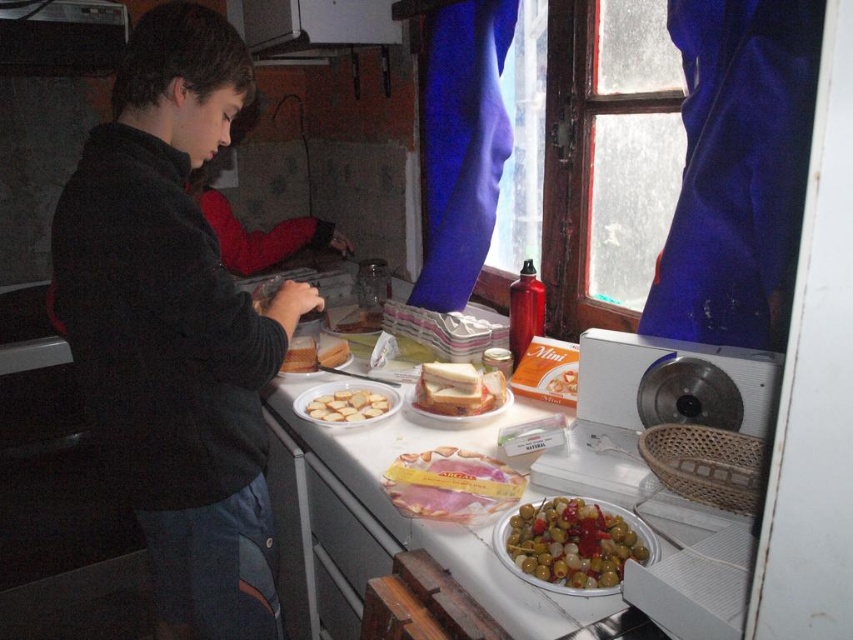
Question: Which object is closer to the camera taking this photo?

Choices:
 (A) white plastic plate at center
 (B) golden crumbly crackers at center

Answer: (A)

Question: Which point is farther to the camera?

Choices:
 (A) sliced pink ham at center
 (B) golden crumbly crackers at center
 (C) white bread sandwich at center
 (D) green olive tapenade at lower center

Answer: (C)

Question: Is sliced pink ham at center positioned in front of matte white bread at center?

Choices:
 (A) yes
 (B) no

Answer: (A)

Question: Which of the following is the farthest from the observer?

Choices:
 (A) (317, 358)
 (B) (410, 472)

Answer: (A)

Question: Is green olive tapenade at lower center behind white bread sandwich at center?

Choices:
 (A) no
 (B) yes

Answer: (A)

Question: Is sliced pink ham at center to the right of matte white bread at center from the viewer's perspective?

Choices:
 (A) yes
 (B) no

Answer: (A)